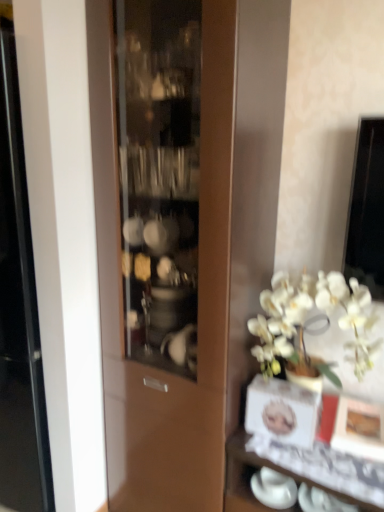
At what (x,y) coordinates should I click in order to perform the action: click on white glossy cup at lower right. Please return your answer as a coordinate pair (x, y). This screenshot has height=512, width=384. Looking at the image, I should click on (274, 489).

The width and height of the screenshot is (384, 512). What do you see at coordinates (274, 489) in the screenshot? I see `white glossy cup at lower right` at bounding box center [274, 489].

You are a GUI agent. You are given a task and a screenshot of the screen. Output one action in this format:
    pyautogui.click(x=<x>, y=<y>)
    Task: Click on the white glossy vase at lower right
    This screenshot has width=384, height=512.
    Given the screenshot: What is the action you would take?
    pyautogui.click(x=275, y=470)

What do you see at coordinates (275, 470) in the screenshot?
I see `white glossy vase at lower right` at bounding box center [275, 470].

In order to face white glossy vase at lower right, should I rotate leftwards or rightwards?

You should look right and rotate roughly 15.612 degrees.

The width and height of the screenshot is (384, 512). Find the location of `white glossy cup at lower right`. white glossy cup at lower right is located at coordinates (274, 489).

Which object is positioned more to the left, white glossy vase at lower right or white glossy cup at lower right?

Positioned to the left is white glossy cup at lower right.

Is white glossy vase at lower right in front of white glossy cup at lower right?

Yes, white glossy vase at lower right is in front of white glossy cup at lower right.

Does point (339, 471) lie behind point (289, 490)?

No, it is in front of (289, 490).

From the image's perspective, which is below, white glossy vase at lower right or white glossy cup at lower right?

white glossy vase at lower right appears lower in the image.

From a real-world perspective, is white glossy vase at lower right physically located above or below white glossy cup at lower right?

Clearly, from a real-world perspective, white glossy vase at lower right is below white glossy cup at lower right.

Consider the image. Which of these two, white glossy vase at lower right or white glossy cup at lower right, is thinner?

white glossy cup at lower right.

Which of these two, white glossy vase at lower right or white glossy cup at lower right, stands taller?

With more height is white glossy vase at lower right.

Between white glossy vase at lower right and white glossy cup at lower right, which one has larger size?

white glossy vase at lower right is bigger.

Looking at this image, is white glossy vase at lower right located outside white glossy cup at lower right?

Yes, white glossy vase at lower right is located beyond the bounds of white glossy cup at lower right.

Are white glossy vase at lower right and white glossy cup at lower right making contact?

No.

Is white glossy vase at lower right looking in the opposite direction of white glossy cup at lower right?

No, white glossy vase at lower right's orientation is not away from white glossy cup at lower right.

What's the angular difference between white glossy vase at lower right and white glossy cup at lower right's facing directions?

white glossy vase at lower right and white glossy cup at lower right are facing 3.01 degrees away from each other.

Image resolution: width=384 pixels, height=512 pixels. I want to click on shelf that is in front of the white glossy cup at lower right, so (275, 470).

Which is more to the left, white glossy cup at lower right or white glossy vase at lower right?

Positioned to the left is white glossy cup at lower right.

Which is behind, white glossy cup at lower right or white glossy vase at lower right?

white glossy cup at lower right.

Which point is more distant from viewer, (268,474) or (276,458)?

The point (268,474) is farther.

From the image's perspective, between white glossy cup at lower right and white glossy vase at lower right, who is located below?

white glossy vase at lower right.

From a real-world perspective, is white glossy cup at lower right above or below white glossy vase at lower right?

From a real-world perspective, white glossy cup at lower right is physically above white glossy vase at lower right.

From the picture: Between white glossy cup at lower right and white glossy vase at lower right, which one has larger width?

Wider between the two is white glossy vase at lower right.

Is white glossy cup at lower right shorter than white glossy vase at lower right?

Indeed, white glossy cup at lower right has a lesser height compared to white glossy vase at lower right.

In terms of size, does white glossy cup at lower right appear bigger or smaller than white glossy vase at lower right?

In the image, white glossy cup at lower right appears to be smaller than white glossy vase at lower right.

Is white glossy cup at lower right spatially inside white glossy vase at lower right, or outside of it?

white glossy cup at lower right is located inside white glossy vase at lower right.

Are white glossy cup at lower right and white glossy vase at lower right far apart?

No, white glossy cup at lower right is not far away from white glossy vase at lower right.

Is white glossy cup at lower right positioned with its back to white glossy vase at lower right?

Yes, white glossy cup at lower right is facing away from white glossy vase at lower right.

Measure the distance between white glossy cup at lower right and white glossy vase at lower right.

white glossy cup at lower right and white glossy vase at lower right are 4.35 inches apart.

Locate an element on the screen. The height and width of the screenshot is (512, 384). tableware on the left side of white glossy vase at lower right is located at coordinates (274, 489).

Locate an element on the screen. The width and height of the screenshot is (384, 512). tableware above the white glossy vase at lower right (from the image's perspective) is located at coordinates [x=274, y=489].

Locate an element on the screen. The image size is (384, 512). tableware positioned vertically above the white glossy vase at lower right (from a real-world perspective) is located at coordinates (274, 489).